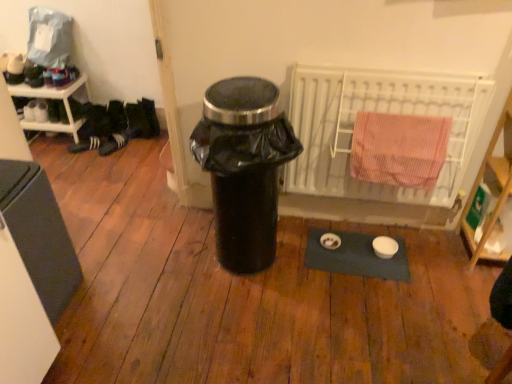
At what (x,y) coordinates should I click in order to perform the action: click on free point to the left of black plastic trash can at center. Please return your answer as a coordinate pair (x, y). The height and width of the screenshot is (384, 512). Looking at the image, I should click on (161, 264).